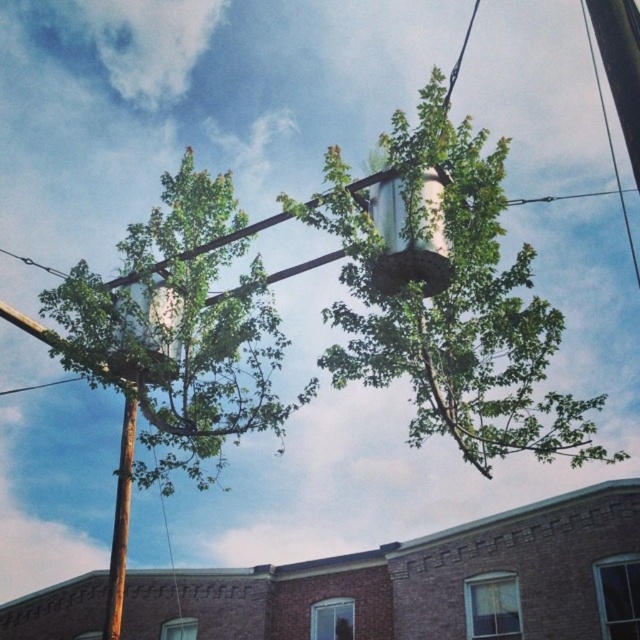
Can you confirm if green leafy tree at center is positioned to the left of brown wooden telegraph pole at left?

No, green leafy tree at center is not to the left of brown wooden telegraph pole at left.

Can you confirm if green leafy tree at center is bigger than brown wooden telegraph pole at left?

Yes.

Who is more distant from viewer, [410,188] or [116,579]?

Positioned behind is point [116,579].

Where is `green leafy tree at center`? Image resolution: width=640 pixels, height=640 pixels. green leafy tree at center is located at coordinates (452, 307).

Does green leafy tree at upper left lie in front of brown wooden telegraph pole at left?

Yes, it is in front of brown wooden telegraph pole at left.

Is green leafy tree at upper left wider than brown wooden telegraph pole at left?

Yes, green leafy tree at upper left is wider than brown wooden telegraph pole at left.

Which is in front, point (88, 369) or point (116, 568)?

Point (116, 568) is in front.

Find the location of a particular element. The height and width of the screenshot is (640, 640). green leafy tree at upper left is located at coordinates (182, 358).

Who is taller, green leafy tree at center or green leafy tree at upper left?

green leafy tree at center is taller.

Between point (454, 326) and point (179, 340), which one is positioned in front?

Point (454, 326)

Who is more distant from viewer, (499,364) or (275,365)?

The point (275,365) is more distant.

Identify the location of green leafy tree at center. Image resolution: width=640 pixels, height=640 pixels. (452, 307).